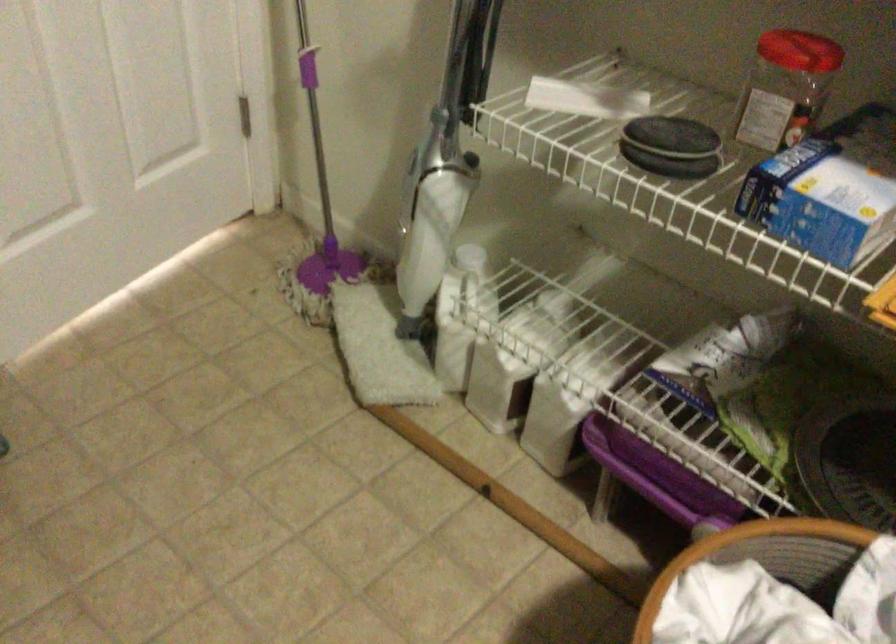
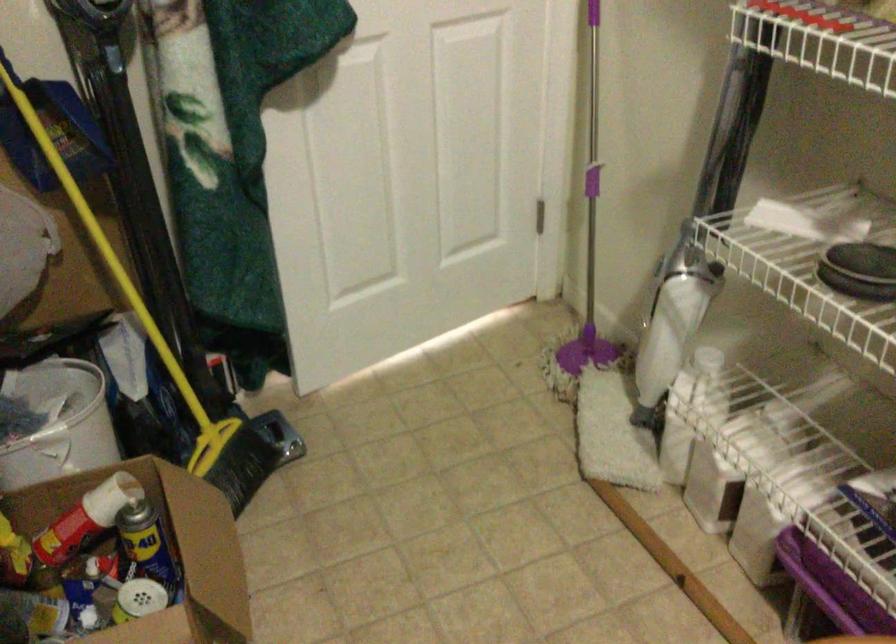
Question: The camera is either moving clockwise (left) or counter-clockwise (right) around the object. The first image is from the beginning of the video and the second image is from the end. Is the camera moving left or right when shooting the video?

Choices:
 (A) Left
 (B) Right

Answer: (B)